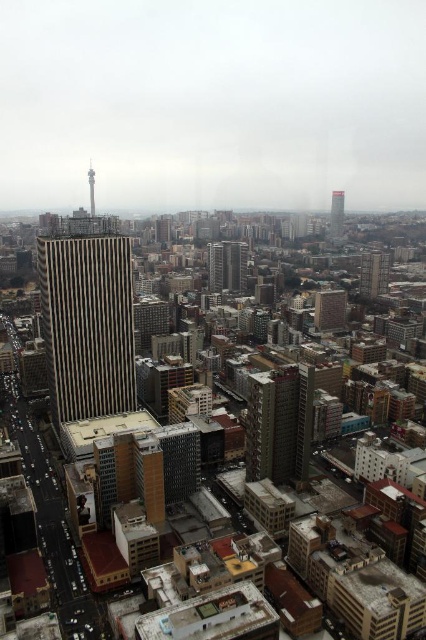
You are a drone operator tasked with flying a drone from the gold striped building at center to the smooth glass skyscraper at upper center. What is the approximate distance you need to cover in feet?

The gold striped building at center is 1525.37 feet away from the smooth glass skyscraper at upper center, so the drone needs to cover approximately 1525.37 feet.